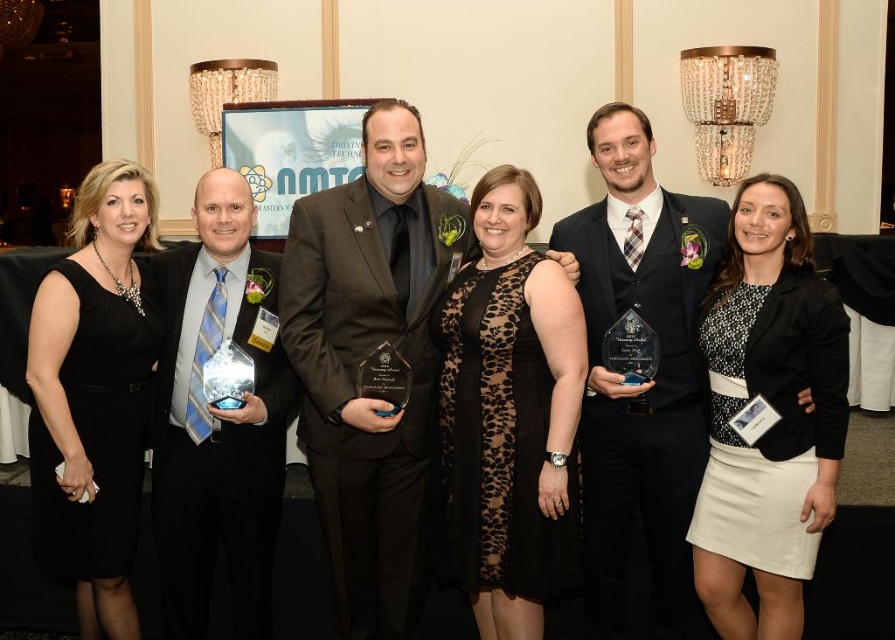
Does matte black suit at center appear on the right side of shiny silver award at center?

Correct, you'll find matte black suit at center to the right of shiny silver award at center.

The height and width of the screenshot is (640, 895). Describe the element at coordinates (372, 364) in the screenshot. I see `matte black suit at center` at that location.

Locate an element on the screen. matte black suit at center is located at coordinates 372,364.

Who is more forward, (427, 394) or (663, 490)?

Point (663, 490) is more forward.

Is point (356, 388) positioned behind point (632, 202)?

No, (356, 388) is in front of (632, 202).

You are a GUI agent. You are given a task and a screenshot of the screen. Output one action in this format:
    pyautogui.click(x=<x>, y=<y>)
    Task: Click on the matte black suit at center
    Image resolution: width=895 pixels, height=640 pixels.
    Given the screenshot: What is the action you would take?
    pyautogui.click(x=372, y=364)

Locate an element on the screen. The image size is (895, 640). matte black suit at center is located at coordinates (372, 364).

Can you confirm if shiny dark blue suit at center is wider than black dress at left?

Correct, the width of shiny dark blue suit at center exceeds that of black dress at left.

Who is higher up, shiny dark blue suit at center or black dress at left?

shiny dark blue suit at center is above.

Does point (635, 442) lie behind point (70, 433)?

That is True.

Find the location of a particular element. The height and width of the screenshot is (640, 895). shiny dark blue suit at center is located at coordinates (644, 380).